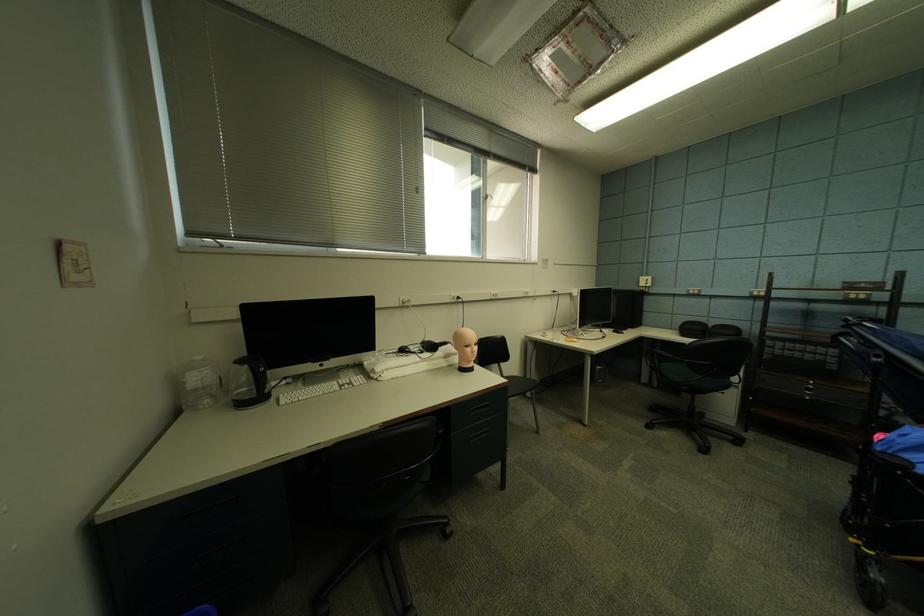
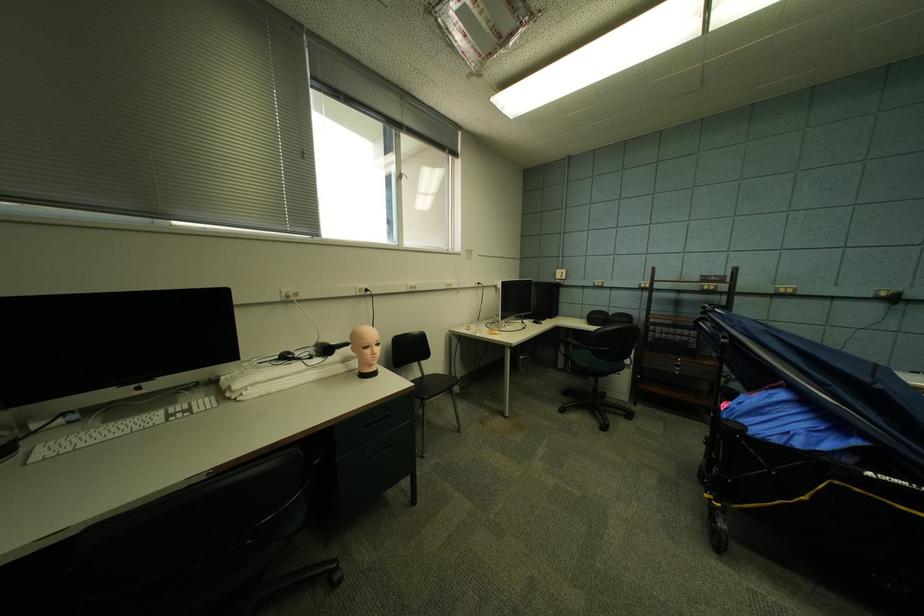
Question: The camera is either moving clockwise (left) or counter-clockwise (right) around the object. The first image is from the beginning of the video and the second image is from the end. Is the camera moving left or right when shooting the video?

Choices:
 (A) Left
 (B) Right

Answer: (A)